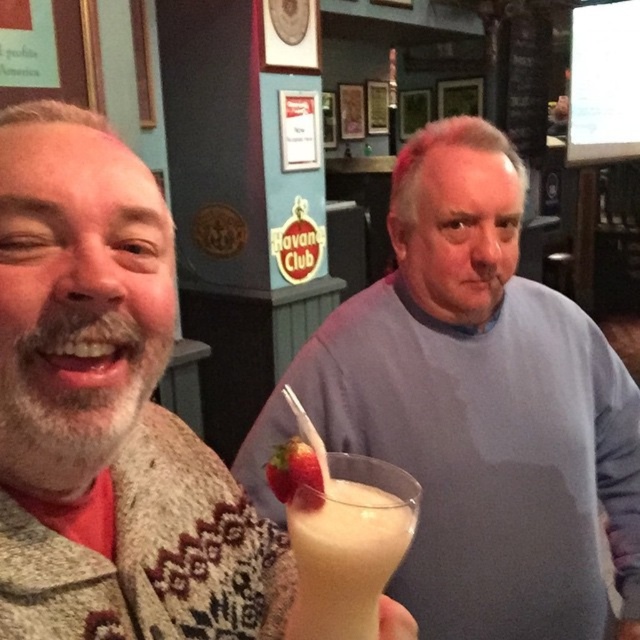
Consider the image. You are a fashion designer observing the image. You need to determine the spatial relationship between the gray matte sweater at center and the knitted sweater at left. Which one is positioned lower in the image?

The gray matte sweater at center is positioned lower than the knitted sweater at left because it is described as being below it.

You are a bartender who needs to place a new menu card between the gray matte sweater at center and the white frothy milkshake at center. Since the menu card is 10 cm tall, will it fit vertically between them?

The gray matte sweater at center is taller than the white frothy milkshake at center. The menu card is 10 cm tall, but without knowing the exact height difference between the sweater and the milkshake, we cannot determine if there is enough vertical space. Please measure the available space between them first.